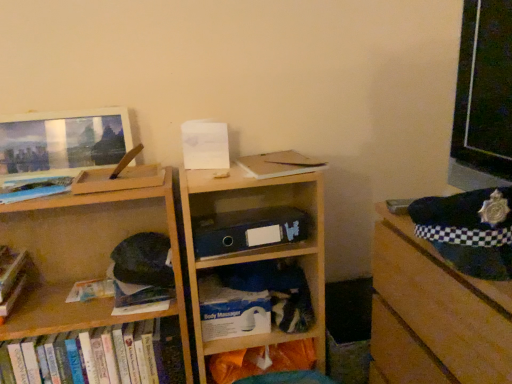
Question: Would you say hardcover books at lower left, the 1th book positioned from the bottom, contains white matte paperback book at center?

Choices:
 (A) no
 (B) yes

Answer: (A)

Question: From the image's perspective, is hardcover books at lower left, arranged as the 2th book when viewed from the top, above white matte paperback book at center?

Choices:
 (A) no
 (B) yes

Answer: (A)

Question: Would you consider hardcover books at lower left, the 1th book positioned from the bottom, to be distant from white matte paperback book at center?

Choices:
 (A) no
 (B) yes

Answer: (A)

Question: Is hardcover books at lower left, arranged as the 2th book when viewed from the top, oriented away from white matte paperback book at center?

Choices:
 (A) yes
 (B) no

Answer: (B)

Question: Can you confirm if hardcover books at lower left, arranged as the 2th book when viewed from the top, is shorter than white matte paperback book at center?

Choices:
 (A) yes
 (B) no

Answer: (B)

Question: Based on their sizes in the image, would you say hardcover books at lower left, the 1th book positioned from the bottom, is bigger or smaller than white plastic body massager at lower center, marked as the 2th shelf in a left-to-right arrangement?

Choices:
 (A) big
 (B) small

Answer: (A)

Question: Choose the correct answer: Is hardcover books at lower left, arranged as the 2th book when viewed from the top, inside white plastic body massager at lower center, which is counted as the first shelf, starting from the right, or outside it?

Choices:
 (A) outside
 (B) inside

Answer: (A)

Question: Visually, is hardcover books at lower left, the 1th book positioned from the bottom, positioned to the left or to the right of white plastic body massager at lower center, marked as the 2th shelf in a left-to-right arrangement?

Choices:
 (A) right
 (B) left

Answer: (B)

Question: In the image, is hardcover books at lower left, the 1th book positioned from the bottom, positioned in front of or behind white plastic body massager at lower center, which is counted as the first shelf, starting from the right?

Choices:
 (A) front
 (B) behind

Answer: (A)

Question: Is matte blue book at left, which appears as the 1th book when viewed from the top, wider or thinner than wooden bookshelf at center?

Choices:
 (A) wide
 (B) thin

Answer: (B)

Question: In terms of height, does matte blue book at left, arranged as the second book when ordered from the bottom, look taller or shorter compared to wooden bookshelf at center?

Choices:
 (A) short
 (B) tall

Answer: (A)

Question: In the image, is matte blue book at left, arranged as the second book when ordered from the bottom, on the left side or the right side of wooden bookshelf at center?

Choices:
 (A) right
 (B) left

Answer: (B)

Question: Do you think matte blue book at left, which appears as the 1th book when viewed from the top, is within wooden bookshelf at center, or outside of it?

Choices:
 (A) inside
 (B) outside

Answer: (B)

Question: In the image, is wooden bookshelf at left, marked as the 1th shelf in a left-to-right arrangement, positioned in front of or behind white plastic body massager at lower center, which is counted as the first shelf, starting from the right?

Choices:
 (A) behind
 (B) front

Answer: (B)

Question: From a real-world perspective, is wooden bookshelf at left, marked as the 1th shelf in a left-to-right arrangement, physically located above or below white plastic body massager at lower center, marked as the 2th shelf in a left-to-right arrangement?

Choices:
 (A) above
 (B) below

Answer: (A)